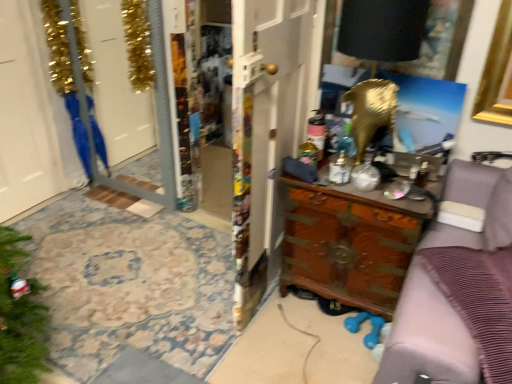
Where is `empty space that is in between wooden carved dresser at center and wooden door at center, the 1th door in the right-to-left sequence`? empty space that is in between wooden carved dresser at center and wooden door at center, the 1th door in the right-to-left sequence is located at coordinates (298, 327).